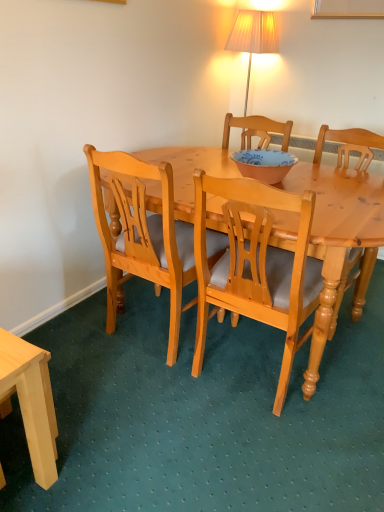
The width and height of the screenshot is (384, 512). What are the coordinates of `empty space that is to the right of light wood desk at lower left` in the screenshot? It's located at pyautogui.click(x=95, y=439).